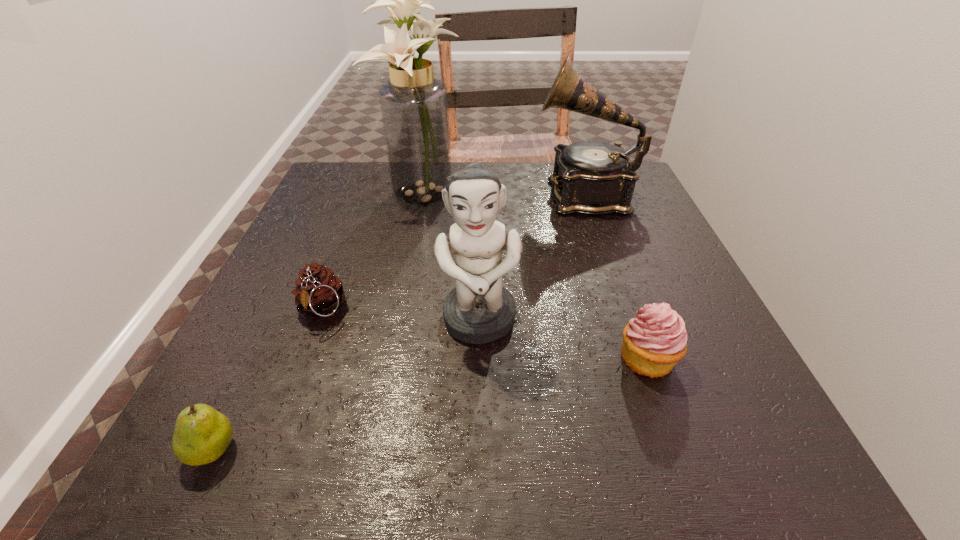
At what (x,y) coordinates should I click in order to perform the action: click on phonograph record that is at the right edge. Please return your answer as a coordinate pair (x, y). The width and height of the screenshot is (960, 540). Looking at the image, I should click on (590, 177).

Where is `cupcake located in the right edge section of the desktop`? cupcake located in the right edge section of the desktop is located at coordinates (655, 340).

The width and height of the screenshot is (960, 540). In order to click on object that is at the far left corner in this screenshot , I will do `click(414, 107)`.

Locate an element on the screen. This screenshot has height=540, width=960. object located at the near left corner is located at coordinates (202, 434).

What are the coordinates of `object located at the far right corner` in the screenshot? It's located at (590, 177).

This screenshot has height=540, width=960. Find the location of `vacant region at the left edge of the desktop`. vacant region at the left edge of the desktop is located at coordinates (251, 408).

Locate an element on the screen. This screenshot has width=960, height=540. vacant space at the right edge of the desktop is located at coordinates (678, 256).

You are a GUI agent. You are given a task and a screenshot of the screen. Output one action in this format:
    pyautogui.click(x=<x>, y=<y>)
    Task: Click on the blank space at the far left corner
    
    Given the screenshot: What is the action you would take?
    pyautogui.click(x=339, y=193)

In the image, there is a desktop. Where is `free region at the near right corner`? The image size is (960, 540). free region at the near right corner is located at coordinates (675, 426).

Find the location of `free space between the cupcake and the figurine`. free space between the cupcake and the figurine is located at coordinates (564, 340).